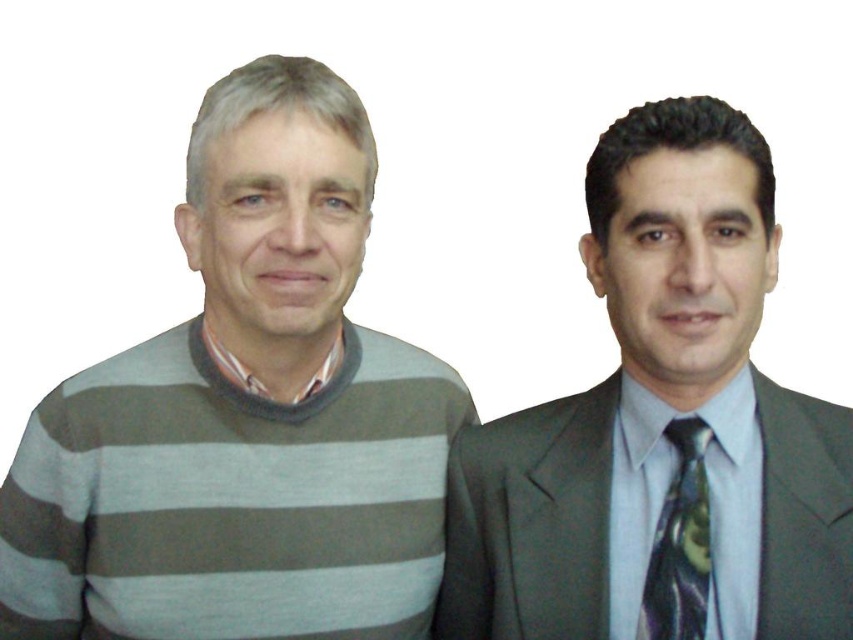
Question: Is gray striped sweater at left behind shiny dark green tie at right?

Choices:
 (A) no
 (B) yes

Answer: (B)

Question: Is matte gray suit at right to the left of shiny dark green tie at right from the viewer's perspective?

Choices:
 (A) yes
 (B) no

Answer: (A)

Question: Which of the following is the closest to the observer?

Choices:
 (A) (714, 262)
 (B) (701, 596)

Answer: (A)

Question: Which object is farther from the camera taking this photo?

Choices:
 (A) shiny dark green tie at right
 (B) gray striped sweater at left

Answer: (B)

Question: Which object is positioned farthest from the gray striped sweater at left?

Choices:
 (A) shiny dark green tie at right
 (B) matte gray suit at right

Answer: (A)

Question: Can you confirm if gray striped sweater at left is positioned to the right of shiny dark green tie at right?

Choices:
 (A) no
 (B) yes

Answer: (A)